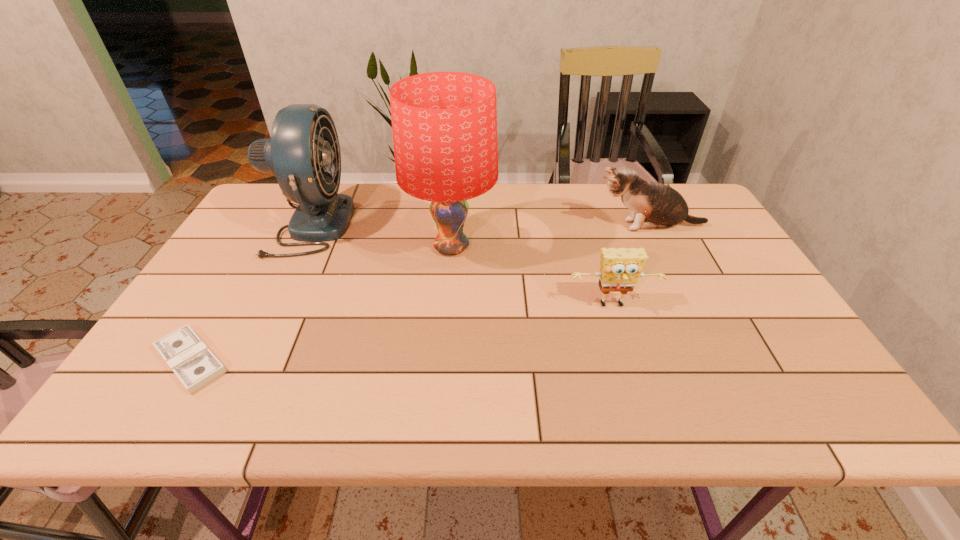
The height and width of the screenshot is (540, 960). In the image, there is a desktop. Find the location of `vacant space at the far right corner`. vacant space at the far right corner is located at coordinates (702, 202).

You are a GUI agent. You are given a task and a screenshot of the screen. Output one action in this format:
    pyautogui.click(x=<x>, y=<y>)
    Task: Click on the vacant position at the near right corner of the desktop
    
    Given the screenshot: What is the action you would take?
    pyautogui.click(x=780, y=390)

Find the location of a particular element. Image resolution: width=960 pixels, height=540 pixels. free space between the lampshade and the second tallest object is located at coordinates (380, 235).

Identify the location of vacant space that is in between the fourth tallest object and the third object from left to right. The width and height of the screenshot is (960, 540). (532, 276).

You are a GUI agent. You are given a task and a screenshot of the screen. Output one action in this format:
    pyautogui.click(x=<x>, y=<y>)
    Task: Click on the blank region between the cat and the second tallest object
    This screenshot has width=960, height=540.
    Given the screenshot: What is the action you would take?
    pyautogui.click(x=479, y=225)

Where is `free space between the second tallest object and the shortest object`? The image size is (960, 540). free space between the second tallest object and the shortest object is located at coordinates (251, 292).

Where is `free spot between the third object from right to left and the cat`? free spot between the third object from right to left and the cat is located at coordinates (550, 237).

Locate an element on the screen. vacant space that's between the lampshade and the fourth shortest object is located at coordinates (380, 235).

Identify the location of empty space that is in between the fourth shortest object and the shortest object. (251, 292).

Locate an element on the screen. Image resolution: width=960 pixels, height=540 pixels. vacant area between the third tallest object and the tallest object is located at coordinates (550, 237).